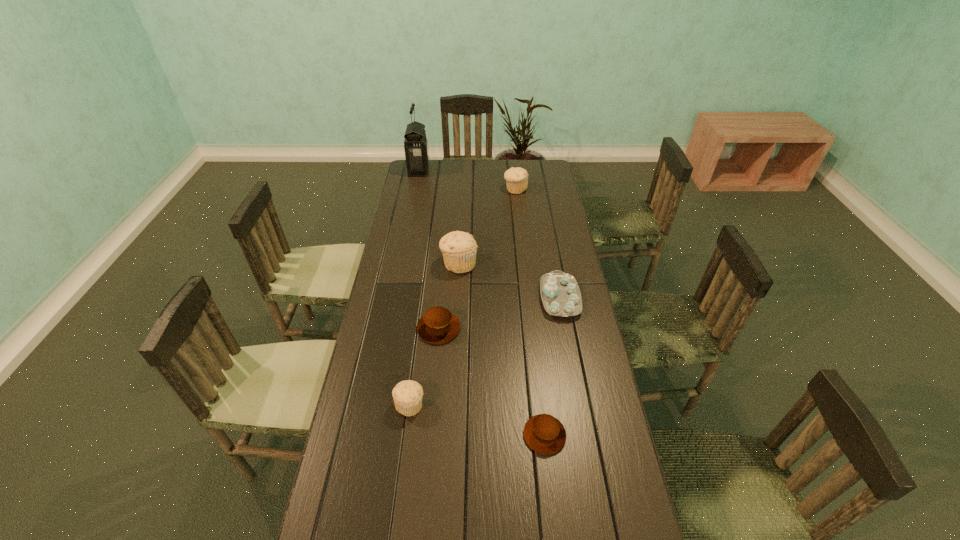
Identify the location of vacant region at the far right corner of the desktop. (539, 177).

Locate an element on the screen. empty space between the chinaware and the rightmost beige muffin is located at coordinates (538, 244).

The height and width of the screenshot is (540, 960). I want to click on free space between the chinaware and the farther brown muffin, so click(499, 313).

Identify the location of vacant space that's between the nearer brown muffin and the chinaware. The width and height of the screenshot is (960, 540). (552, 367).

The height and width of the screenshot is (540, 960). What are the coordinates of `vacant space in between the smallest beige muffin and the third farthest muffin` in the screenshot? It's located at (424, 367).

The height and width of the screenshot is (540, 960). In order to click on empty location between the farthest beige muffin and the right brown muffin in this screenshot , I will do `click(530, 312)`.

You are a GUI agent. You are given a task and a screenshot of the screen. Output one action in this format:
    pyautogui.click(x=<x>, y=<y>)
    Task: Click on the vacant space that is in between the tallest object and the second tallest object
    The height and width of the screenshot is (540, 960).
    Given the screenshot: What is the action you would take?
    pyautogui.click(x=439, y=217)

The width and height of the screenshot is (960, 540). Identify the location of free space between the smallest beige muffin and the shortest object. (477, 420).

This screenshot has height=540, width=960. In order to click on object that is the sixth closest one to the fifth nearest object in this screenshot , I will do `click(543, 433)`.

The width and height of the screenshot is (960, 540). I want to click on the fourth closest object to the chinaware, so click(x=407, y=395).